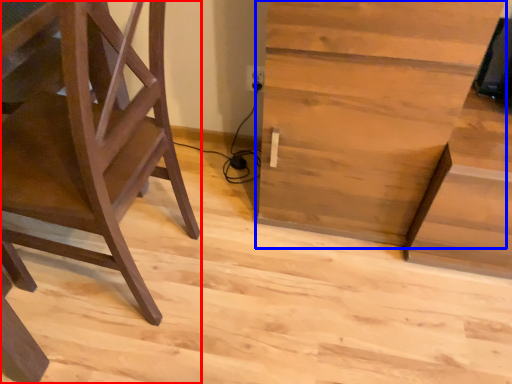
Question: Which object is closer to the camera taking this photo, furniture (highlighted by a red box) or table (highlighted by a blue box)?

Choices:
 (A) furniture
 (B) table

Answer: (A)